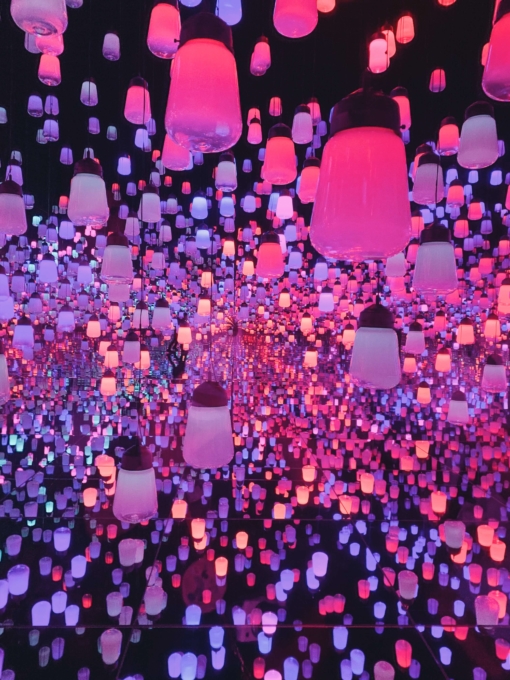
Find the location of `moderate sized pink light`. moderate sized pink light is located at coordinates (197, 118).